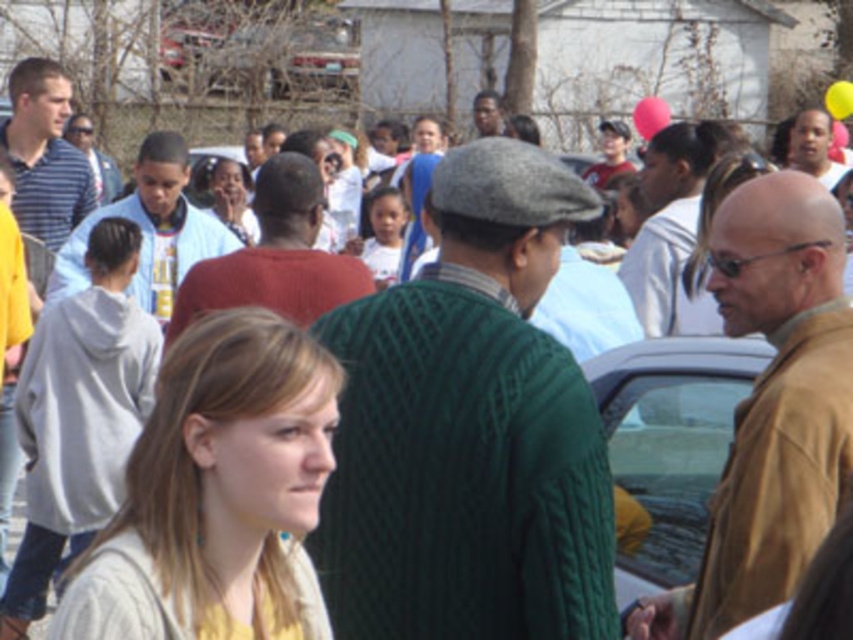
Question: Which object is the closest to the white jersey at center?

Choices:
 (A) red sweater at center
 (B) matte green sweater at center

Answer: (A)

Question: Among these points, which one is farthest from the camera?

Choices:
 (A) (822, 160)
 (B) (4, 605)
 (C) (13, 92)
 (D) (386, 413)

Answer: (A)

Question: In this image, where is brown leather jacket at right located relative to light gray hoodie at center?

Choices:
 (A) below
 (B) above

Answer: (B)

Question: Which object is closer to the camera taking this photo?

Choices:
 (A) matte green sweater at center
 (B) smooth skin face at upper right
 (C) striped cotton shirt at left
 (D) light gray hoodie at center

Answer: (D)

Question: Does striped cotton shirt at left come behind smooth skin face at upper right?

Choices:
 (A) yes
 (B) no

Answer: (B)

Question: Can you confirm if matte white shirt at center is bigger than smooth skin face at upper right?

Choices:
 (A) no
 (B) yes

Answer: (B)